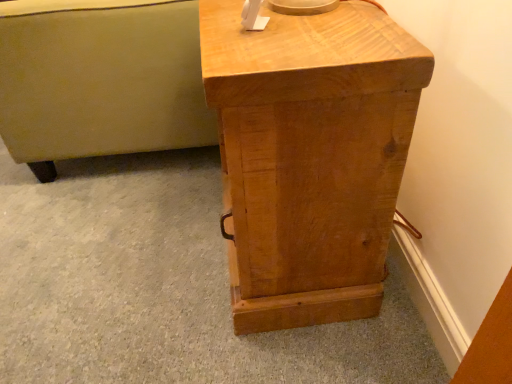
Question: Are matte beige ottoman at left and light brown wood nightstand at center far apart?

Choices:
 (A) no
 (B) yes

Answer: (A)

Question: Does matte beige ottoman at left appear on the left side of light brown wood nightstand at center?

Choices:
 (A) yes
 (B) no

Answer: (A)

Question: Is matte beige ottoman at left wider than light brown wood nightstand at center?

Choices:
 (A) no
 (B) yes

Answer: (B)

Question: Is matte beige ottoman at left facing towards light brown wood nightstand at center?

Choices:
 (A) no
 (B) yes

Answer: (A)

Question: Is matte beige ottoman at left taller than light brown wood nightstand at center?

Choices:
 (A) yes
 (B) no

Answer: (B)

Question: Considering the relative positions of matte beige ottoman at left and light brown wood nightstand at center in the image provided, is matte beige ottoman at left in front of light brown wood nightstand at center?

Choices:
 (A) no
 (B) yes

Answer: (A)

Question: From a real-world perspective, is light brown wood nightstand at center on top of matte beige ottoman at left?

Choices:
 (A) no
 (B) yes

Answer: (B)

Question: Are light brown wood nightstand at center and matte beige ottoman at left making contact?

Choices:
 (A) no
 (B) yes

Answer: (A)

Question: Is light brown wood nightstand at center oriented away from matte beige ottoman at left?

Choices:
 (A) no
 (B) yes

Answer: (A)

Question: Considering the relative sizes of light brown wood nightstand at center and matte beige ottoman at left in the image provided, is light brown wood nightstand at center bigger than matte beige ottoman at left?

Choices:
 (A) no
 (B) yes

Answer: (A)

Question: From the image's perspective, is light brown wood nightstand at center beneath matte beige ottoman at left?

Choices:
 (A) no
 (B) yes

Answer: (B)

Question: Is light brown wood nightstand at center far away from matte beige ottoman at left?

Choices:
 (A) no
 (B) yes

Answer: (A)

Question: In terms of width, does matte beige ottoman at left look wider or thinner when compared to light brown wood nightstand at center?

Choices:
 (A) thin
 (B) wide

Answer: (B)